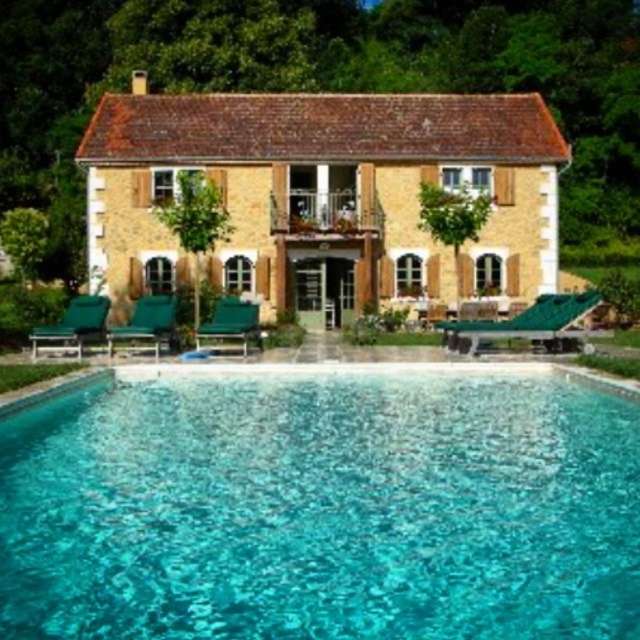
Does green plastic chair at center appear over green fabric chair at lower left?

Yes, green plastic chair at center is above green fabric chair at lower left.

Which is below, green plastic chair at center or green fabric chair at lower left?

green fabric chair at lower left is below.

Looking at this image, measure the distance between point (253, 328) and camera.

A distance of 24.57 meters exists between point (253, 328) and camera.

This screenshot has height=640, width=640. In order to click on green plastic chair at center in this screenshot , I will do `click(230, 323)`.

Which of these two, green plastic lounge chair at center or green fabric chair at lower left, stands taller?

green plastic lounge chair at center

Is green plastic lounge chair at center to the left of green fabric chair at lower left from the viewer's perspective?

In fact, green plastic lounge chair at center is to the right of green fabric chair at lower left.

Between point (531, 305) and point (136, 323), which one is positioned behind?

The point (531, 305) is more distant.

Identify the location of green plastic lounge chair at center. Image resolution: width=640 pixels, height=640 pixels. (528, 323).

Who is lower down, green fabric chair at lower left or green fabric chair at center?

green fabric chair at center is lower down.

Is point (148, 316) positioned in front of point (477, 308)?

Yes, point (148, 316) is in front of point (477, 308).

The height and width of the screenshot is (640, 640). Find the location of `green fabric chair at lower left`. green fabric chair at lower left is located at coordinates (147, 321).